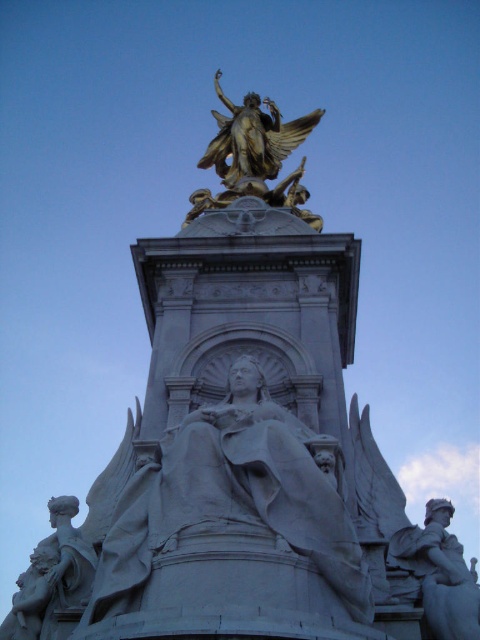
Looking at this image, you are standing in front of the monument and want to take a photo that includes both the white marble statue at lower right and the white marble statue at lower left. Which statue should you adjust your camera angle to look up towards?

You should adjust your camera angle to look up towards the white marble statue at lower right because it is positioned above the white marble statue at lower left.